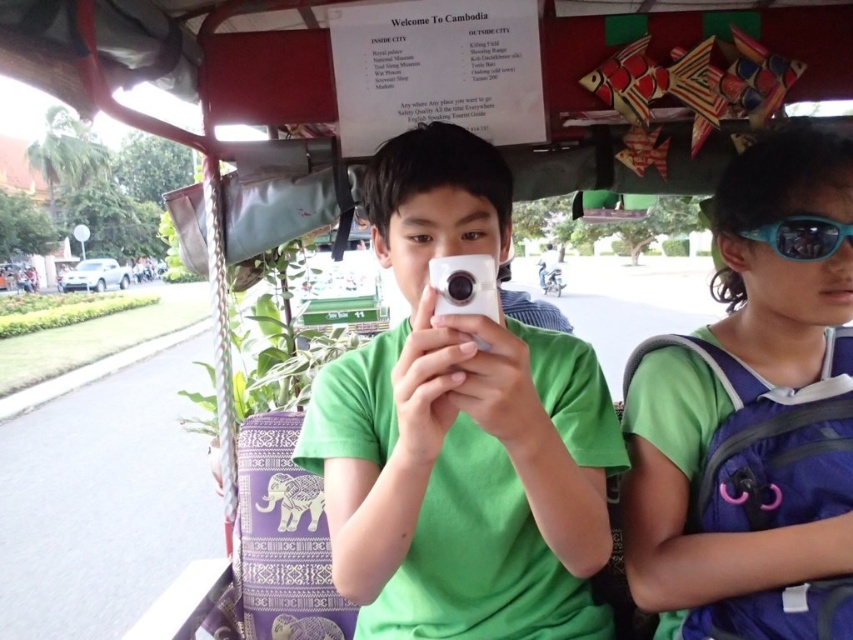
Who is more forward, (496, 360) or (785, 262)?

Point (496, 360)

Is point (465, 180) farther from camera compared to point (637, 598)?

No.

Find the location of a particular element. Image resolution: width=853 pixels, height=640 pixels. green matte shirt at center is located at coordinates (460, 432).

Is white plastic camera at center closer to camera compared to blue reflective lens at upper right?

Yes, it is.

Which is more to the right, white plastic camera at center or blue reflective lens at upper right?

From the viewer's perspective, blue reflective lens at upper right appears more on the right side.

Between point (492, 268) and point (828, 246), which one is positioned in front?

Positioned in front is point (492, 268).

Find the location of a particular element. The height and width of the screenshot is (640, 853). white plastic camera at center is located at coordinates (463, 285).

Is point (361, 474) positioned behind point (827, 252)?

No, it is in front of (827, 252).

Which of these two, green matte shirt at center or blue reflective lens at upper right, stands shorter?

Standing shorter between the two is blue reflective lens at upper right.

Describe the element at coordinates (460, 432) in the screenshot. I see `green matte shirt at center` at that location.

The image size is (853, 640). What are the coordinates of `green matte shirt at center` in the screenshot? It's located at (460, 432).